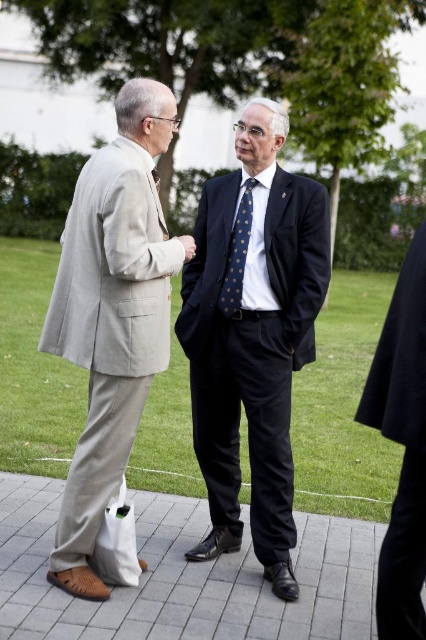
Who is more forward, (98, 524) or (222, 296)?

Point (98, 524) is more forward.

Between point (94, 269) and point (233, 259), which one is positioned in front?

Point (94, 269) is more forward.

The width and height of the screenshot is (426, 640). I want to click on light beige fabric suit at left, so click(x=112, y=314).

Which of these two, polished dark blue suit at center or light beige fabric suit at left, stands taller?

polished dark blue suit at center is taller.

Which is more to the right, polished dark blue suit at center or light beige fabric suit at left?

polished dark blue suit at center

What do you see at coordinates (253, 336) in the screenshot? This screenshot has width=426, height=640. I see `polished dark blue suit at center` at bounding box center [253, 336].

The width and height of the screenshot is (426, 640). I want to click on polished dark blue suit at center, so click(x=253, y=336).

Is point (252, 170) positioned behind point (245, 237)?

Yes.

Image resolution: width=426 pixels, height=640 pixels. I want to click on polished dark blue suit at center, so click(253, 336).

Which is in front, point (210, 540) or point (250, 177)?

Positioned in front is point (250, 177).

At what (x,y) coordinates should I click in order to perform the action: click on polished dark blue suit at center. Please return your answer as a coordinate pair (x, y). Image resolution: width=426 pixels, height=640 pixels. Looking at the image, I should click on (253, 336).